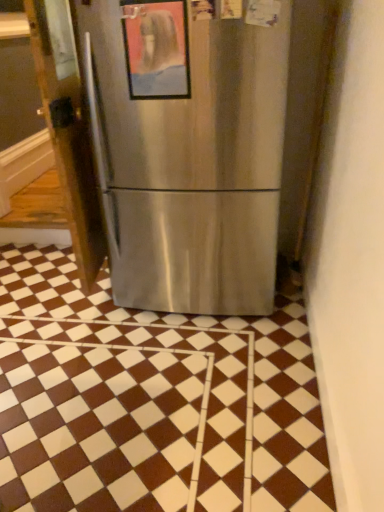
Question: Are metallic framed picture at center and brown/white checkered tile at center beside each other?

Choices:
 (A) no
 (B) yes

Answer: (A)

Question: Does metallic framed picture at center have a greater height compared to brown/white checkered tile at center?

Choices:
 (A) yes
 (B) no

Answer: (A)

Question: Is metallic framed picture at center thinner than brown/white checkered tile at center?

Choices:
 (A) yes
 (B) no

Answer: (A)

Question: Is metallic framed picture at center to the right of brown/white checkered tile at center from the viewer's perspective?

Choices:
 (A) no
 (B) yes

Answer: (B)

Question: Is brown/white checkered tile at center at the back of metallic framed picture at center?

Choices:
 (A) no
 (B) yes

Answer: (A)

Question: Considering the relative sizes of metallic framed picture at center and brown/white checkered tile at center in the image provided, is metallic framed picture at center wider than brown/white checkered tile at center?

Choices:
 (A) yes
 (B) no

Answer: (B)

Question: Is brown/white checkered tile at center at the left side of metallic framed picture at center?

Choices:
 (A) yes
 (B) no

Answer: (A)

Question: Can you confirm if brown/white checkered tile at center is thinner than metallic framed picture at center?

Choices:
 (A) yes
 (B) no

Answer: (B)

Question: Is metallic framed picture at center surrounded by brown/white checkered tile at center?

Choices:
 (A) yes
 (B) no

Answer: (B)

Question: Considering the relative sizes of brown/white checkered tile at center and metallic framed picture at center in the image provided, is brown/white checkered tile at center bigger than metallic framed picture at center?

Choices:
 (A) yes
 (B) no

Answer: (A)

Question: From the image's perspective, is brown/white checkered tile at center located above metallic framed picture at center?

Choices:
 (A) no
 (B) yes

Answer: (A)

Question: From a real-world perspective, is brown/white checkered tile at center under metallic framed picture at center?

Choices:
 (A) yes
 (B) no

Answer: (A)

Question: Is satin silver refrigerator at left oriented away from metallic framed picture at center?

Choices:
 (A) yes
 (B) no

Answer: (B)